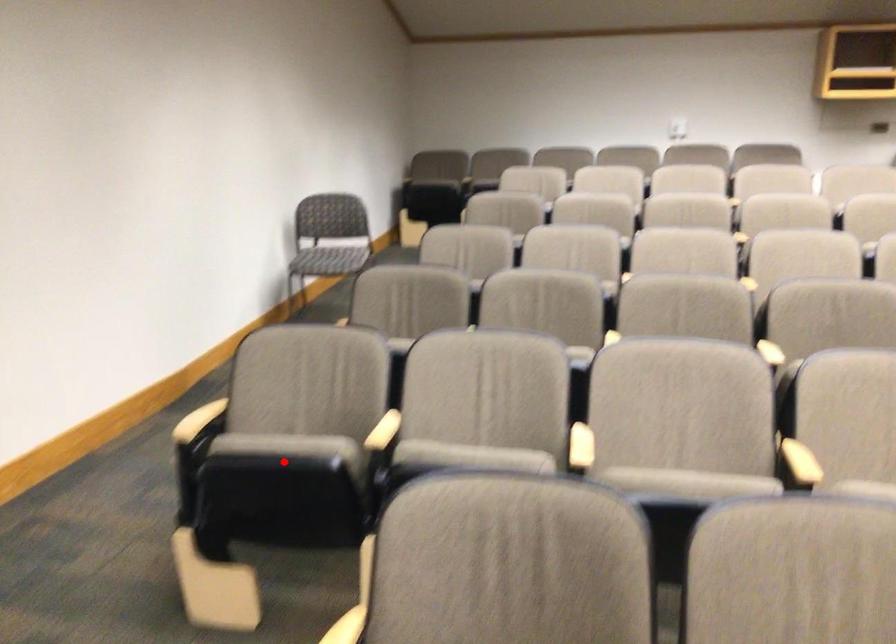
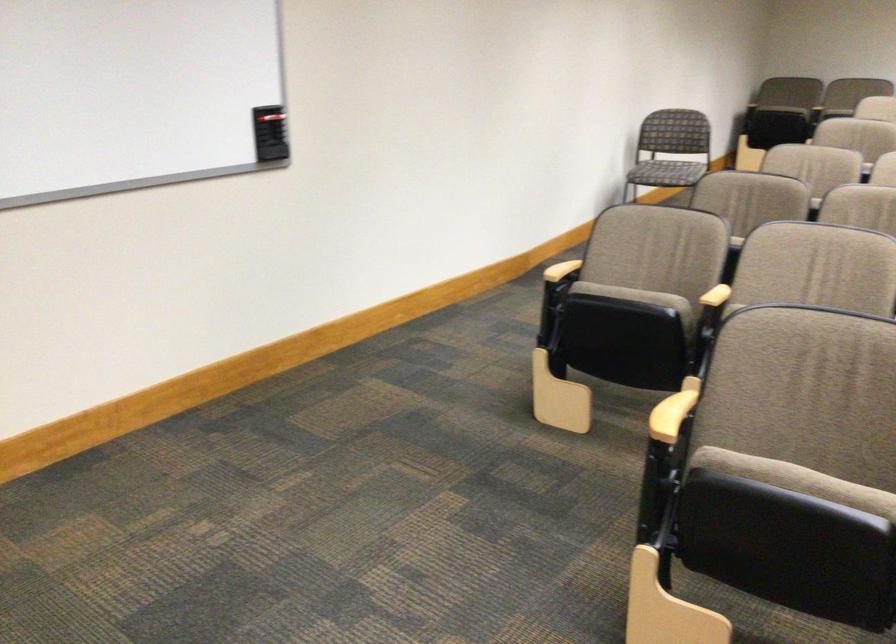
Where in the second image is the point corresponding to the highlighted location from the first image?

(633, 295)